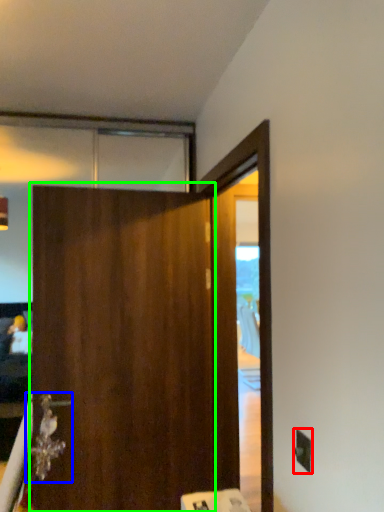
Question: Based on their relative distances, which object is farther from electric outlet (highlighted by a red box)? Choose from door handle (highlighted by a blue box) and barn door (highlighted by a green box).

Choices:
 (A) door handle
 (B) barn door

Answer: (A)